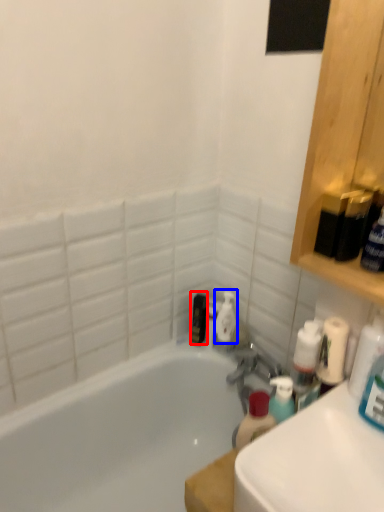
Question: Which point is closer to the camera, toiletry (highlighted by a red box) or cleaning product (highlighted by a blue box)?

Choices:
 (A) toiletry
 (B) cleaning product

Answer: (B)